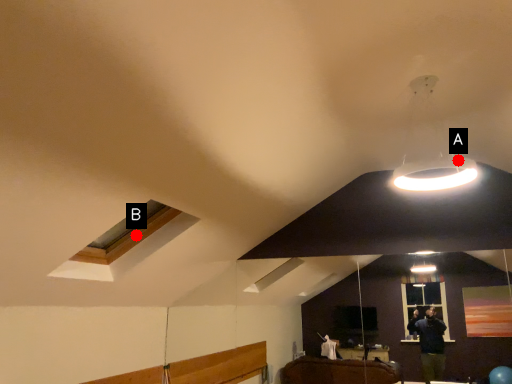
Question: Two points are circled on the image, labeled by A and B beside each circle. Which point is closer to the camera?

Choices:
 (A) A is closer
 (B) B is closer

Answer: (B)